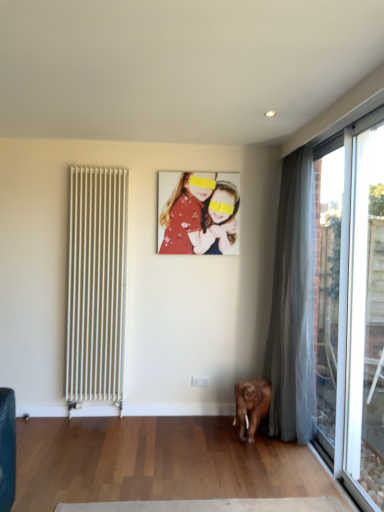
Question: Could you tell me if silky gray curtain at right is turned towards transparent glass door at right, the first window from the front?

Choices:
 (A) yes
 (B) no

Answer: (B)

Question: Is silky gray curtain at right surrounding transparent glass door at right, the 2th window from the back?

Choices:
 (A) no
 (B) yes

Answer: (A)

Question: Does silky gray curtain at right appear on the left side of transparent glass door at right, the first window from the front?

Choices:
 (A) yes
 (B) no

Answer: (A)

Question: From a real-world perspective, does silky gray curtain at right sit lower than transparent glass door at right, the first window from the front?

Choices:
 (A) no
 (B) yes

Answer: (A)

Question: Considering the relative sizes of silky gray curtain at right and transparent glass door at right, the 2th window from the back, in the image provided, is silky gray curtain at right wider than transparent glass door at right, the 2th window from the back,?

Choices:
 (A) no
 (B) yes

Answer: (B)

Question: Looking at their shapes, would you say white metal radiator at left is wider or thinner than transparent glass door at right, the first window from the front?

Choices:
 (A) thin
 (B) wide

Answer: (B)

Question: Is white metal radiator at left inside the boundaries of transparent glass door at right, the first window from the front, or outside?

Choices:
 (A) inside
 (B) outside

Answer: (B)

Question: Considering the positions of white metal radiator at left and transparent glass door at right, the 2th window from the back, in the image, is white metal radiator at left taller or shorter than transparent glass door at right, the 2th window from the back,?

Choices:
 (A) tall
 (B) short

Answer: (B)

Question: From the image's perspective, is white metal radiator at left located above or below transparent glass door at right, the 2th window from the back?

Choices:
 (A) above
 (B) below

Answer: (A)

Question: From a real-world perspective, is transparent glass door at right, the 2th window from the back, positioned above or below white metal radiator at left?

Choices:
 (A) below
 (B) above

Answer: (B)

Question: Considering the positions of transparent glass door at right, the 2th window from the back, and white metal radiator at left in the image, is transparent glass door at right, the 2th window from the back, wider or thinner than white metal radiator at left?

Choices:
 (A) wide
 (B) thin

Answer: (B)

Question: Considering the positions of transparent glass door at right, the first window from the front, and white metal radiator at left in the image, is transparent glass door at right, the first window from the front, bigger or smaller than white metal radiator at left?

Choices:
 (A) big
 (B) small

Answer: (B)

Question: Is transparent glass door at right, the first window from the front, inside or outside of white metal radiator at left?

Choices:
 (A) inside
 (B) outside

Answer: (B)

Question: Relative to matte floral dress at center, is white metal radiator at left in front or behind?

Choices:
 (A) front
 (B) behind

Answer: (A)

Question: In terms of height, does white metal radiator at left look taller or shorter compared to matte floral dress at center?

Choices:
 (A) tall
 (B) short

Answer: (A)